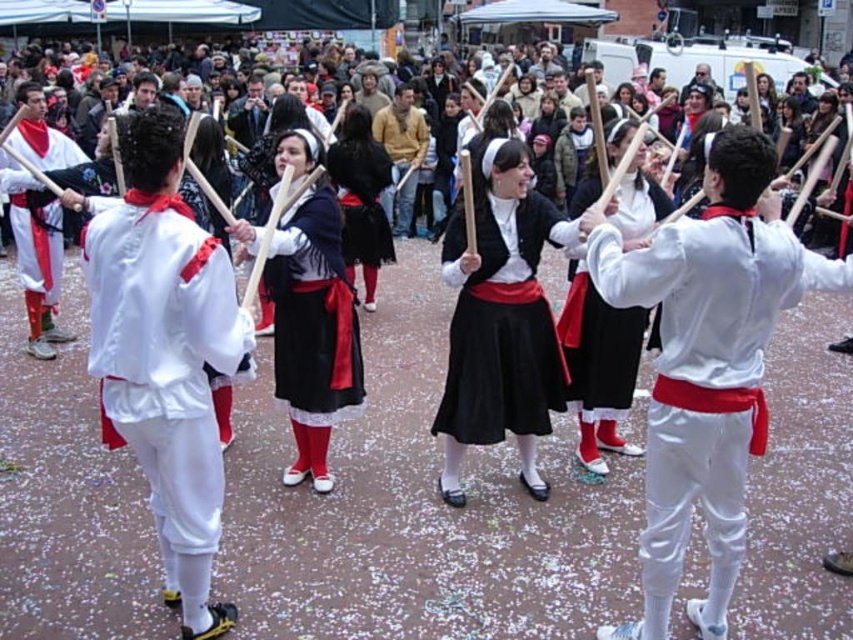
You are a photographer trying to capture the performers in the center of the scene. You notice the matte white blouse at center and the white matte pants at left. Which of these two items should you focus on if you want to photograph the narrower object?

The matte white blouse at center has a lesser width compared to the white matte pants at left, so you should focus on the matte white blouse at center to photograph the narrower object.

You are a photographer at the event and want to capture a photo of the matte white blouse at center and the white matte pants at left. Which one should you focus on first if you want to highlight the shorter item?

The matte white blouse at center is shorter than the white matte pants at left, so you should focus on the matte white blouse at center first to highlight the shorter item.

You are a photographer positioned at the back of the crowd. You want to take a photo of the performers. Which object, the matte black dress at center or the white matte pants at left, will appear closer to you in the photo?

The matte black dress at center will appear closer to you in the photo because it is in front of the white matte pants at left.